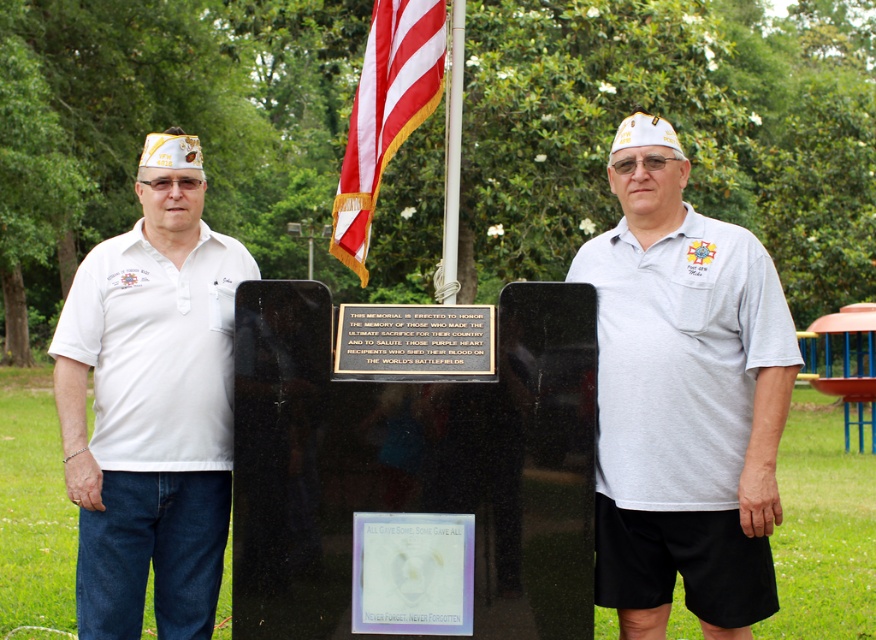
Question: Which of the following is the closest to the observer?

Choices:
 (A) (658, 410)
 (B) (405, 307)

Answer: (A)

Question: Can you confirm if black polished stone plaque at center is bigger than metallic flagpole at center?

Choices:
 (A) no
 (B) yes

Answer: (A)

Question: Estimate the real-world distances between objects in this image. Which object is closer to the white matte shirt at left?

Choices:
 (A) gray cotton shirt at center
 (B) black polished stone plaque at center

Answer: (B)

Question: Considering the relative positions of gray cotton shirt at center and metallic flagpole at center in the image provided, where is gray cotton shirt at center located with respect to metallic flagpole at center?

Choices:
 (A) above
 (B) below

Answer: (B)

Question: Which object appears closest to the camera in this image?

Choices:
 (A) red/white striped fabric at upper center
 (B) black polished stone plaque at center
 (C) gray cotton shirt at center
 (D) metallic flagpole at center

Answer: (B)

Question: Where is red/white striped fabric at upper center located in relation to black polished stone plaque at center in the image?

Choices:
 (A) left
 (B) right

Answer: (A)